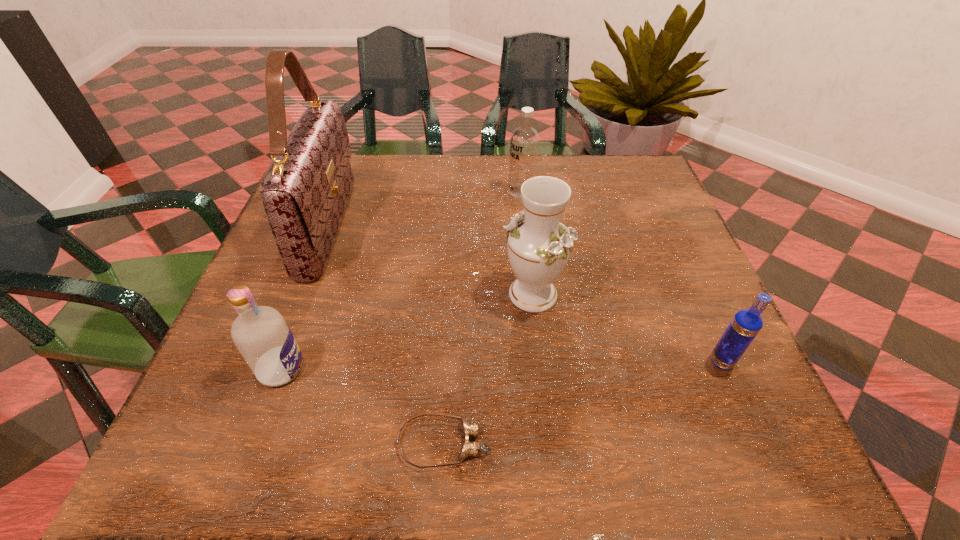
Image resolution: width=960 pixels, height=540 pixels. Find the location of `vodka situated at the left edge`. vodka situated at the left edge is located at coordinates (264, 339).

Where is `object that is at the right edge`? Image resolution: width=960 pixels, height=540 pixels. object that is at the right edge is located at coordinates (746, 324).

The height and width of the screenshot is (540, 960). What are the coordinates of `object that is at the far left corner` in the screenshot? It's located at (305, 191).

The image size is (960, 540). What are the coordinates of `vacant area at the far edge` in the screenshot? It's located at (392, 160).

Identify the location of vacant space at the near edge. This screenshot has width=960, height=540. (435, 464).

The image size is (960, 540). I want to click on free space at the left edge, so click(x=280, y=273).

Locate an element on the screen. This screenshot has width=960, height=540. free space at the right edge of the desktop is located at coordinates (694, 295).

In the image, there is a desktop. Identify the location of vacant space at the near left corner. The image size is (960, 540). (196, 435).

Find the location of a particular element. The image size is (960, 540). free space at the far right corner of the desktop is located at coordinates 649,171.

In the image, there is a desktop. Identify the location of vacant space at the near right corner. This screenshot has height=540, width=960. (686, 420).